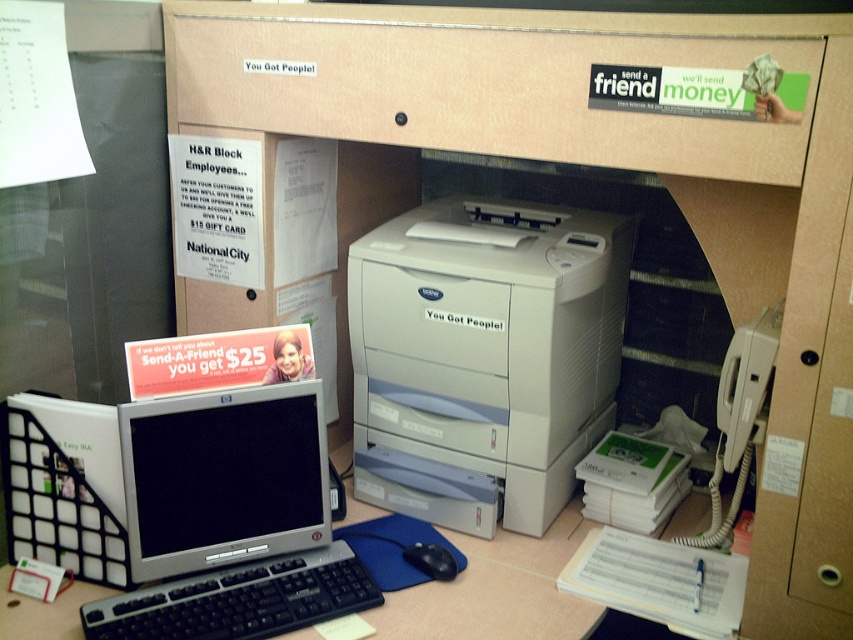
Question: Which object is closer to the camera taking this photo?

Choices:
 (A) black plastic keyboard at lower left
 (B) black matte mouse at center

Answer: (A)

Question: Which point appears closest to the camera in this image?

Choices:
 (A) (271, 390)
 (B) (556, 93)

Answer: (B)

Question: Does matte cardboard drawer at upper center lie in front of black matte mouse at center?

Choices:
 (A) yes
 (B) no

Answer: (A)

Question: Is silver metallic monitor at lower left above black matte mouse at center?

Choices:
 (A) yes
 (B) no

Answer: (A)

Question: Among these objects, which one is farthest from the camera?

Choices:
 (A) black matte mouse at center
 (B) black plastic keyboard at lower left
 (C) white matte printer at center

Answer: (A)

Question: Is matte cardboard drawer at upper center smaller than silver metallic monitor at lower left?

Choices:
 (A) yes
 (B) no

Answer: (B)